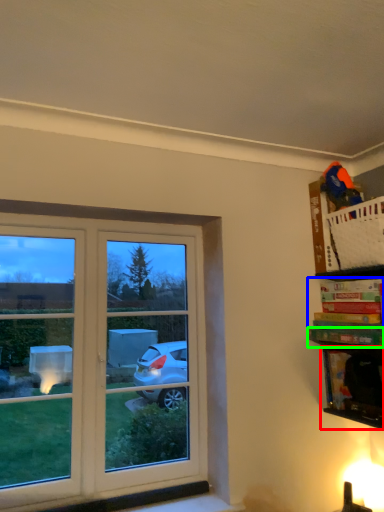
Question: Which is farther away from cabinet (highlighted by a red box)? book (highlighted by a blue box) or book (highlighted by a green box)?

Choices:
 (A) book
 (B) book

Answer: (A)